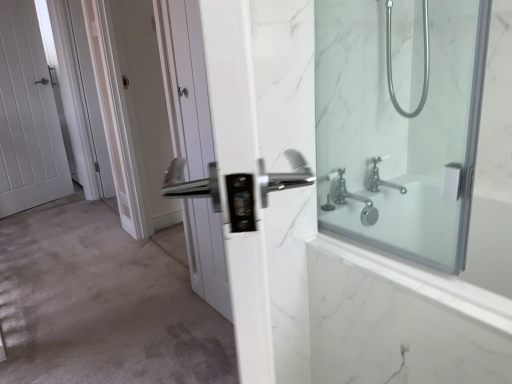
Question: Is the position of satin nickel handle at center, acting as the 2th screen door starting from the back, less distant than that of white glossy door handle at center, arranged as the second door when viewed from the left?

Choices:
 (A) no
 (B) yes

Answer: (A)

Question: Can we say satin nickel handle at center, acting as the 1th screen door starting from the right, lies outside white glossy door handle at center, arranged as the second door when viewed from the left?

Choices:
 (A) no
 (B) yes

Answer: (B)

Question: Does satin nickel handle at center, acting as the 1th screen door starting from the right, have a lesser height compared to white glossy door handle at center, arranged as the second door when viewed from the left?

Choices:
 (A) yes
 (B) no

Answer: (B)

Question: Considering the relative sizes of satin nickel handle at center, which appears as the 2th screen door when viewed from the left, and white glossy door handle at center, the 1th door from the right, in the image provided, is satin nickel handle at center, which appears as the 2th screen door when viewed from the left, taller than white glossy door handle at center, the 1th door from the right,?

Choices:
 (A) yes
 (B) no

Answer: (A)

Question: From the image's perspective, is satin nickel handle at center, which appears as the 2th screen door when viewed from the left, below white glossy door handle at center, arranged as the second door when viewed from the left?

Choices:
 (A) yes
 (B) no

Answer: (B)

Question: From the image's perspective, is white glossy door handle at center, arranged as the second door when viewed from the left, above or below white marble bathtub at right?

Choices:
 (A) above
 (B) below

Answer: (A)

Question: Is white glossy door handle at center, the 1th door from the right, wider or thinner than white marble bathtub at right?

Choices:
 (A) wide
 (B) thin

Answer: (B)

Question: From a real-world perspective, is white glossy door handle at center, the 1th door when ordered from front to back, positioned above or below white marble bathtub at right?

Choices:
 (A) above
 (B) below

Answer: (A)

Question: In the image, is white glossy door handle at center, the second door when ordered from back to front, positioned in front of or behind white marble bathtub at right?

Choices:
 (A) front
 (B) behind

Answer: (B)

Question: Considering the positions of white glossy door at upper left, which is the 2th screen door in right-to-left order, and silver metallic shower arm at upper right in the image, is white glossy door at upper left, which is the 2th screen door in right-to-left order, taller or shorter than silver metallic shower arm at upper right?

Choices:
 (A) short
 (B) tall

Answer: (B)

Question: Is white glossy door at upper left, which is the 2th screen door in right-to-left order, inside the boundaries of silver metallic shower arm at upper right, or outside?

Choices:
 (A) outside
 (B) inside

Answer: (A)

Question: Based on their sizes in the image, would you say white glossy door at upper left, the first screen door when ordered from left to right, is bigger or smaller than silver metallic shower arm at upper right?

Choices:
 (A) small
 (B) big

Answer: (B)

Question: Is point (81, 48) closer or farther from the camera than point (395, 109)?

Choices:
 (A) farther
 (B) closer

Answer: (A)

Question: Is white matte door at center to the left or to the right of clear glass shower at right in the image?

Choices:
 (A) right
 (B) left

Answer: (B)

Question: Considering the positions of white matte door at center and clear glass shower at right in the image, is white matte door at center wider or thinner than clear glass shower at right?

Choices:
 (A) wide
 (B) thin

Answer: (A)